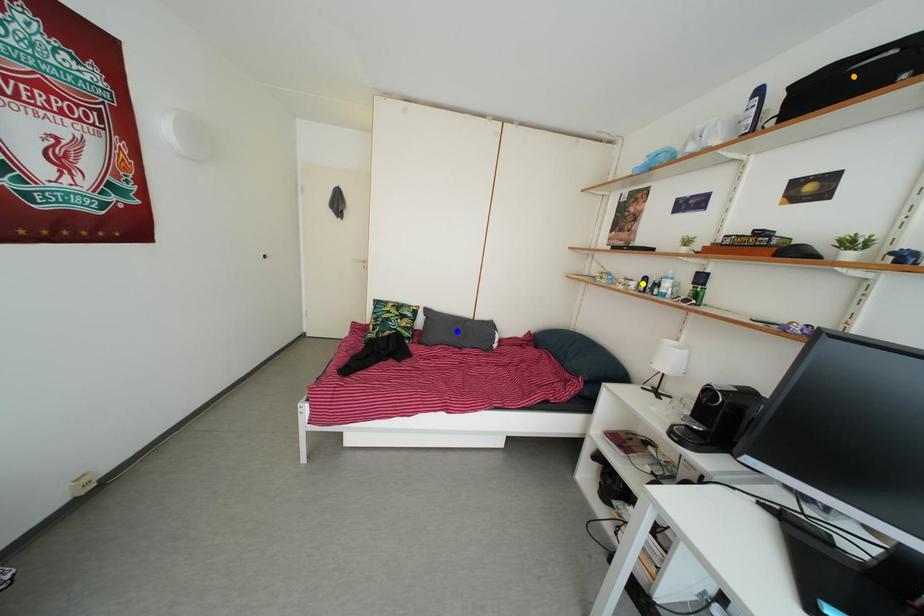
Order these from nearest to farthest:
1. yellow point
2. orange point
3. blue point

1. orange point
2. yellow point
3. blue point